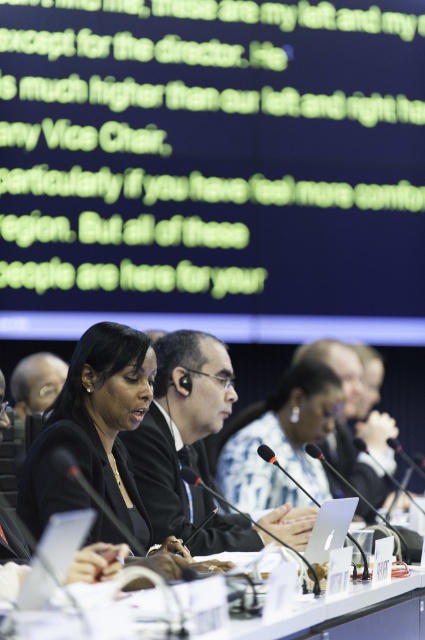
Question: Is black glossy hair at center in front of white plastic table at center?

Choices:
 (A) yes
 (B) no

Answer: (B)

Question: Does black glossy hair at center appear under white plastic table at center?

Choices:
 (A) yes
 (B) no

Answer: (B)

Question: Which of the following is the closest to the observer?

Choices:
 (A) black glossy hair at center
 (B) white plastic table at center

Answer: (B)

Question: Does black glossy hair at center have a smaller size compared to white plastic table at center?

Choices:
 (A) no
 (B) yes

Answer: (B)